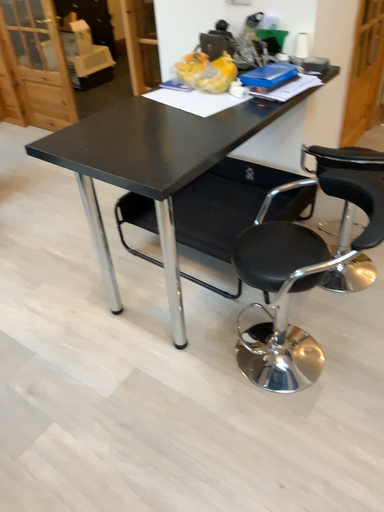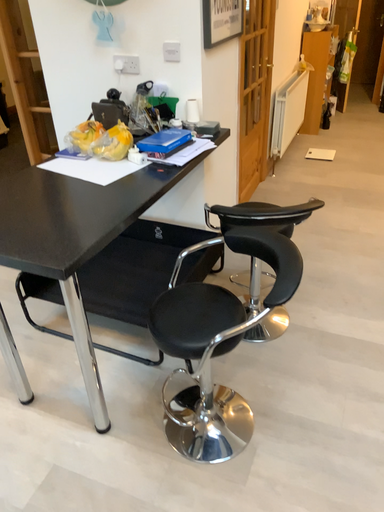
Question: Which way did the camera rotate in the video?

Choices:
 (A) rotated right
 (B) rotated left

Answer: (A)